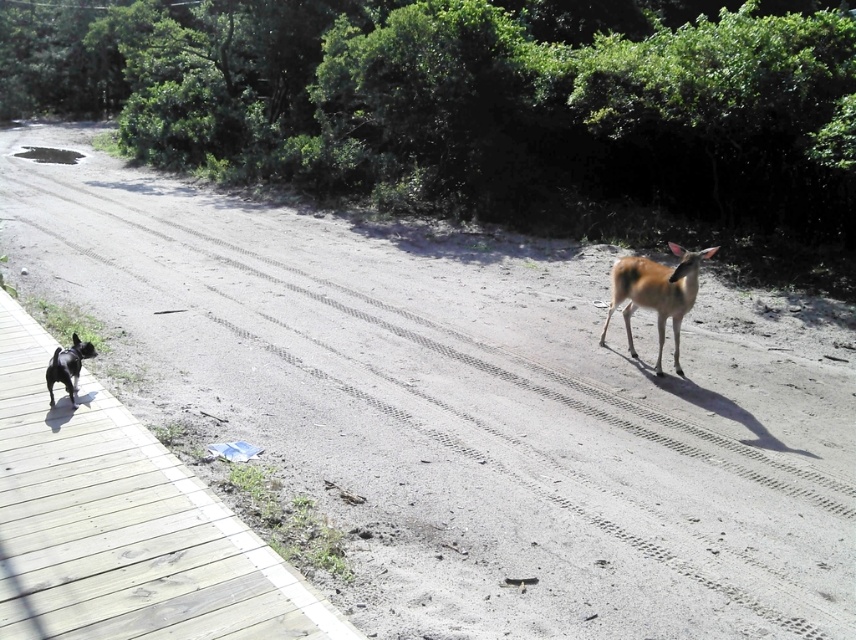
Question: Which point is closer to the camera?

Choices:
 (A) brown matte/deer at center-right
 (B) black glossy french bulldog at left

Answer: (B)

Question: Can you confirm if brown matte/deer at center-right is bigger than black glossy french bulldog at left?

Choices:
 (A) no
 (B) yes

Answer: (B)

Question: Does brown matte/deer at center-right have a greater width compared to black glossy french bulldog at left?

Choices:
 (A) yes
 (B) no

Answer: (A)

Question: Which point is farther from the camera taking this photo?

Choices:
 (A) (54, 369)
 (B) (654, 292)

Answer: (B)

Question: Is brown matte/deer at center-right above black glossy french bulldog at left?

Choices:
 (A) yes
 (B) no

Answer: (A)